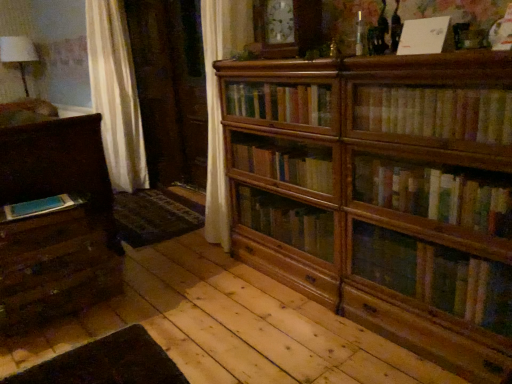
Describe the element at coordinates (435, 112) in the screenshot. I see `yellowish paperbacks at upper right, which ranks as the 2th book in top-to-bottom order` at that location.

Image resolution: width=512 pixels, height=384 pixels. I want to click on blue matte book at lower left, which is the 1th book in bottom-to-top order, so click(38, 207).

In the scene shown: In order to face blue matte book at lower left, which appears as the 1th book when viewed from the back, should I rotate leftwards or rightwards?

A 26.607 degree turn to the left will do.

Find the location of a particular element. The width and height of the screenshot is (512, 384). white paper at upper center, which ranks as the second book in back-to-front order is located at coordinates (423, 36).

Describe the element at coordinates (423, 36) in the screenshot. Image resolution: width=512 pixels, height=384 pixels. I see `white paper at upper center, positioned as the third book in bottom-to-top order` at that location.

In order to face wooden drawer at lower left, which is the first drawer in bottom-to-top order, should I rotate leftwards or rightwards?

You should rotate left by 25.358 degrees.

At what (x,y) coordinates should I click in order to perform the action: click on wooden drawer at lower left, placed as the second drawer when sorted from bottom to top. Please return your answer as a coordinate pair (x, y). This screenshot has height=384, width=512. Looking at the image, I should click on (52, 263).

Describe the element at coordinates (52, 263) in the screenshot. The image size is (512, 384). I see `wooden drawer at lower left, which is the first drawer in top-to-bottom order` at that location.

Where is `matte dark brown chest of drawers at left`? The width and height of the screenshot is (512, 384). matte dark brown chest of drawers at left is located at coordinates (56, 223).

Would you say blue matte book at lower left, which appears as the 1th book when viewed from the back, is to the left or to the right of yellowish paperbacks at upper right, which ranks as the 2th book in top-to-bottom order, in the picture?

In the image, blue matte book at lower left, which appears as the 1th book when viewed from the back, appears on the left side of yellowish paperbacks at upper right, which ranks as the 2th book in top-to-bottom order.

In terms of width, does blue matte book at lower left, which appears as the 1th book when viewed from the back, look wider or thinner when compared to yellowish paperbacks at upper right, the first book when ordered from front to back?

Considering their sizes, blue matte book at lower left, which appears as the 1th book when viewed from the back, looks broader than yellowish paperbacks at upper right, the first book when ordered from front to back.

Can you tell me how much blue matte book at lower left, which is the third book from top to bottom, and yellowish paperbacks at upper right, the 3th book when ordered from left to right, differ in facing direction?

blue matte book at lower left, which is the third book from top to bottom, and yellowish paperbacks at upper right, the 3th book when ordered from left to right, are facing 7.76 degrees away from each other.

From a real-world perspective, is blue matte book at lower left, which appears as the 1th book when viewed from the back, over yellowish paperbacks at upper right, the 3th book when ordered from left to right?

No, from a real-world perspective, blue matte book at lower left, which appears as the 1th book when viewed from the back, is not over yellowish paperbacks at upper right, the 3th book when ordered from left to right

Between yellowish paperbacks at upper right, the first book when ordered from front to back, and wooden drawer at lower left, which is the first drawer in top-to-bottom order, which one has more height?

wooden drawer at lower left, which is the first drawer in top-to-bottom order, is taller.

In the scene shown: From the image's perspective, which one is positioned lower, yellowish paperbacks at upper right, the 1th book viewed from the right, or wooden drawer at lower left, which is the first drawer in top-to-bottom order?

wooden drawer at lower left, which is the first drawer in top-to-bottom order, is shown below in the image.

Considering the relative sizes of yellowish paperbacks at upper right, the first book when ordered from front to back, and wooden drawer at lower left, placed as the second drawer when sorted from bottom to top, in the image provided, is yellowish paperbacks at upper right, the first book when ordered from front to back, bigger than wooden drawer at lower left, placed as the second drawer when sorted from bottom to top,?

Incorrect, yellowish paperbacks at upper right, the first book when ordered from front to back, is not larger than wooden drawer at lower left, placed as the second drawer when sorted from bottom to top.

In the scene shown: Can you confirm if yellowish paperbacks at upper right, which is the 3th book in back-to-front order, is thinner than wooden drawer at lower left, which is the first drawer in top-to-bottom order?

Correct, the width of yellowish paperbacks at upper right, which is the 3th book in back-to-front order, is less than that of wooden drawer at lower left, which is the first drawer in top-to-bottom order.

Considering the relative positions of yellowish paperbacks at upper right, which ranks as the 2th book in top-to-bottom order, and blue matte book at lower left, positioned as the third book in right-to-left order, in the image provided, is yellowish paperbacks at upper right, which ranks as the 2th book in top-to-bottom order, to the right of blue matte book at lower left, positioned as the third book in right-to-left order, from the viewer's perspective?

Yes, yellowish paperbacks at upper right, which ranks as the 2th book in top-to-bottom order, is to the right of blue matte book at lower left, positioned as the third book in right-to-left order.

How different are the orientations of yellowish paperbacks at upper right, the 1th book viewed from the right, and blue matte book at lower left, the first book when ordered from left to right, in degrees?

The angular difference between yellowish paperbacks at upper right, the 1th book viewed from the right, and blue matte book at lower left, the first book when ordered from left to right, is 7.76 degrees.

From the picture: Does yellowish paperbacks at upper right, the 3th book when ordered from left to right, have a larger size compared to blue matte book at lower left, positioned as the third book in right-to-left order?

Yes, yellowish paperbacks at upper right, the 3th book when ordered from left to right, is bigger than blue matte book at lower left, positioned as the third book in right-to-left order.

The image size is (512, 384). Find the location of `book that is the 1st object located above the blue matte book at lower left, which is the 3th book in front-to-back order (from the image's perspective)`. book that is the 1st object located above the blue matte book at lower left, which is the 3th book in front-to-back order (from the image's perspective) is located at coordinates (435, 112).

How many degrees apart are the facing directions of wooden drawer at lower left, which is the first drawer in top-to-bottom order, and wooden bookcase at center?

3.23 degrees separate the facing orientations of wooden drawer at lower left, which is the first drawer in top-to-bottom order, and wooden bookcase at center.

Can you confirm if wooden drawer at lower left, which is the first drawer in top-to-bottom order, is shorter than wooden bookcase at center?

Indeed, wooden drawer at lower left, which is the first drawer in top-to-bottom order, has a lesser height compared to wooden bookcase at center.

Which is in front, wooden drawer at lower left, which is the first drawer in top-to-bottom order, or wooden bookcase at center?

wooden bookcase at center is in front.

You are a GUI agent. You are given a task and a screenshot of the screen. Output one action in this format:
    pyautogui.click(x=<x>, y=<y>)
    Task: Click on the drawer that is the 1st object located below the wooden bookcase at center (from the image's perspective)
    This screenshot has height=384, width=512.
    Given the screenshot: What is the action you would take?
    pyautogui.click(x=52, y=263)

Which is correct: white paper at upper center, which is the second book from right to left, is inside wooden drawer at lower left, which is the first drawer in top-to-bottom order, or outside of it?

white paper at upper center, which is the second book from right to left, is spatially situated outside wooden drawer at lower left, which is the first drawer in top-to-bottom order.

Is white paper at upper center, positioned as the third book in bottom-to-top order, oriented towards wooden drawer at lower left, placed as the second drawer when sorted from bottom to top?

No, white paper at upper center, positioned as the third book in bottom-to-top order, is not facing towards wooden drawer at lower left, placed as the second drawer when sorted from bottom to top.

Who is bigger, white paper at upper center, which is the second book from right to left, or wooden drawer at lower left, which is the first drawer in top-to-bottom order?

wooden drawer at lower left, which is the first drawer in top-to-bottom order.

Between white paper at upper center, positioned as the first book in top-to-bottom order, and wooden drawer at lower left, which is the first drawer in top-to-bottom order, which one has less height?

white paper at upper center, positioned as the first book in top-to-bottom order.

Could you measure the distance between white paper at upper center, positioned as the third book in bottom-to-top order, and matte dark brown chest of drawers at left?

white paper at upper center, positioned as the third book in bottom-to-top order, and matte dark brown chest of drawers at left are 6.11 feet apart.

From a real-world perspective, is white paper at upper center, which is the second book from right to left, under matte dark brown chest of drawers at left?

No.

Looking at their sizes, would you say white paper at upper center, the 2th book viewed from the front, is wider or thinner than matte dark brown chest of drawers at left?

Clearly, white paper at upper center, the 2th book viewed from the front, has less width compared to matte dark brown chest of drawers at left.

Considering the positions of objects matte dark brown chest of drawers at left and blue matte book at lower left, which appears as the 1th book when viewed from the back, in the image provided, who is more to the right, matte dark brown chest of drawers at left or blue matte book at lower left, which appears as the 1th book when viewed from the back,?

blue matte book at lower left, which appears as the 1th book when viewed from the back.

Between matte dark brown chest of drawers at left and blue matte book at lower left, which appears as the 1th book when viewed from the back, which one has smaller width?

blue matte book at lower left, which appears as the 1th book when viewed from the back.

You are a GUI agent. You are given a task and a screenshot of the screen. Output one action in this format:
    pyautogui.click(x=<x>, y=<y>)
    Task: Click on the chest of drawers above the blue matte book at lower left, positioned as the third book in right-to-left order (from the image's perspective)
    The width and height of the screenshot is (512, 384).
    Given the screenshot: What is the action you would take?
    pyautogui.click(x=56, y=223)

Is matte dark brown chest of drawers at left bigger than blue matte book at lower left, which is the 3th book in front-to-back order?

Indeed, matte dark brown chest of drawers at left has a larger size compared to blue matte book at lower left, which is the 3th book in front-to-back order.

Locate an element on the screen. This screenshot has width=512, height=384. book below the yellowish paperbacks at upper right, the 2th book when ordered from bottom to top (from a real-world perspective) is located at coordinates (38, 207).

Starting from the yellowish paperbacks at upper right, the 1th book viewed from the right, which drawer is the 2nd one to the left? Please provide its 2D coordinates.

[(52, 263)]

Looking at the image, which one is located further to white paper at upper center, the second book when ordered from left to right, blue matte book at lower left, which is the 3th book in front-to-back order, or yellowish paperbacks at upper right, which ranks as the 2th book in top-to-bottom order?

blue matte book at lower left, which is the 3th book in front-to-back order, lies further to white paper at upper center, the second book when ordered from left to right, than the other object.

Based on their spatial positions, is wooden bookcase at center or matte dark brown chest of drawers at left closer to wooden drawer at lower left, which is the first drawer in top-to-bottom order?

matte dark brown chest of drawers at left lies closer to wooden drawer at lower left, which is the first drawer in top-to-bottom order, than the other object.

Which object lies further to the anchor point blue matte book at lower left, the first book when ordered from left to right, yellowish paperbacks at upper right, the 2th book when ordered from bottom to top, or white paper at upper center, positioned as the first book in top-to-bottom order?

white paper at upper center, positioned as the first book in top-to-bottom order, is further to blue matte book at lower left, the first book when ordered from left to right.

Which object lies nearer to the anchor point wooden drawer at lower left, placed as the second drawer when sorted from bottom to top, blue matte book at lower left, which is the third book from top to bottom, or yellowish paperbacks at upper right, the first book when ordered from front to back?

blue matte book at lower left, which is the third book from top to bottom, is closer to wooden drawer at lower left, placed as the second drawer when sorted from bottom to top.

Estimate the real-world distances between objects in this image. Which object is further from white paper at upper center, which is the second book from right to left, matte dark brown chest of drawers at left or wooden drawer at lower left, arranged as the 2th drawer when viewed from the top?

Among the two, wooden drawer at lower left, arranged as the 2th drawer when viewed from the top, is located further to white paper at upper center, which is the second book from right to left.

From the image, which object appears to be farther from white paper at upper center, the 2th book viewed from the front, wooden drawer at lower left, which is the first drawer in bottom-to-top order, or blue matte book at lower left, which is the 1th book in bottom-to-top order?

Among the two, wooden drawer at lower left, which is the first drawer in bottom-to-top order, is located further to white paper at upper center, the 2th book viewed from the front.

In the scene shown: When comparing their distances from yellowish paperbacks at upper right, which is the 3th book in back-to-front order, does wooden drawer at lower left, which is the first drawer in bottom-to-top order, or matte dark brown chest of drawers at left seem closer?

Based on the image, matte dark brown chest of drawers at left appears to be nearer to yellowish paperbacks at upper right, which is the 3th book in back-to-front order.

Estimate the real-world distances between objects in this image. Which object is further from wooden drawer at lower left, which is the first drawer in top-to-bottom order, matte dark brown chest of drawers at left or wooden bookcase at center?

wooden bookcase at center is positioned further to the anchor wooden drawer at lower left, which is the first drawer in top-to-bottom order.

Locate an element on the screen. drawer between wooden drawer at lower left, placed as the second drawer when sorted from bottom to top, and white paper at upper center, which is the second book from right to left, from left to right is located at coordinates (62, 295).

Locate an element on the screen. This screenshot has width=512, height=384. drawer between blue matte book at lower left, which appears as the 1th book when viewed from the back, and white paper at upper center, which ranks as the second book in back-to-front order is located at coordinates 62,295.

You are a GUI agent. You are given a task and a screenshot of the screen. Output one action in this format:
    pyautogui.click(x=<x>, y=<y>)
    Task: Click on the drawer between blue matte book at lower left, which appears as the 1th book when viewed from the back, and wooden drawer at lower left, which is the first drawer in bottom-to-top order, from top to bottom
    
    Given the screenshot: What is the action you would take?
    52,263

The width and height of the screenshot is (512, 384). I want to click on drawer between matte dark brown chest of drawers at left and blue matte book at lower left, the first book when ordered from left to right, in the horizontal direction, so click(x=52, y=263).